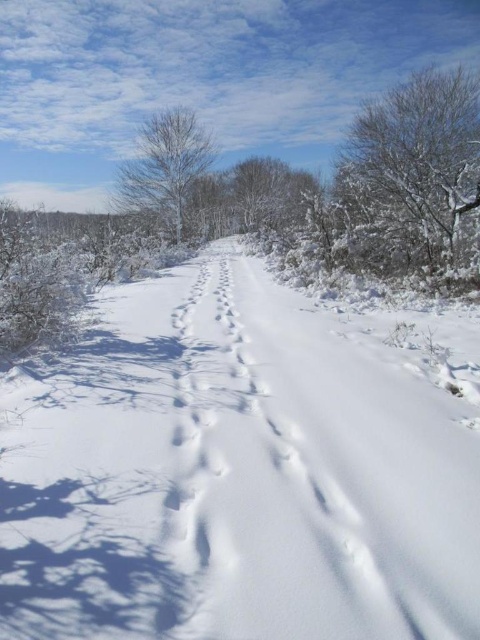
Question: Can you confirm if snow-covered tree at upper right is positioned below bare snow-covered tree at center?

Choices:
 (A) no
 (B) yes

Answer: (B)

Question: Which point is farther to the camera?

Choices:
 (A) snow-covered tree at upper right
 (B) bare snow-covered tree at center

Answer: (B)

Question: Is snow-covered tree at upper right wider than bare snow-covered tree at center?

Choices:
 (A) yes
 (B) no

Answer: (A)

Question: Can you confirm if snow-covered tree at upper right is thinner than bare snow-covered tree at center?

Choices:
 (A) yes
 (B) no

Answer: (B)

Question: Which of the following is the closest to the observer?

Choices:
 (A) bare snow-covered tree at center
 (B) snow-covered tree at upper right

Answer: (B)

Question: Which of the following is the closest to the observer?

Choices:
 (A) bare snow-covered tree at center
 (B) snow-covered tree at upper right

Answer: (B)